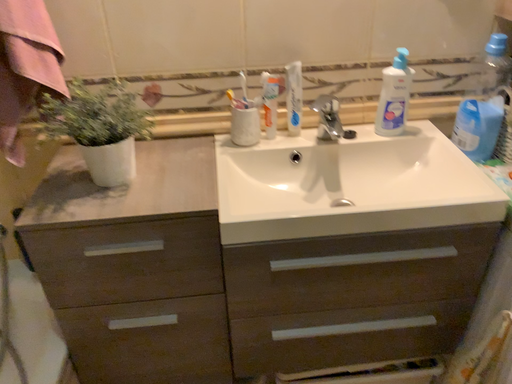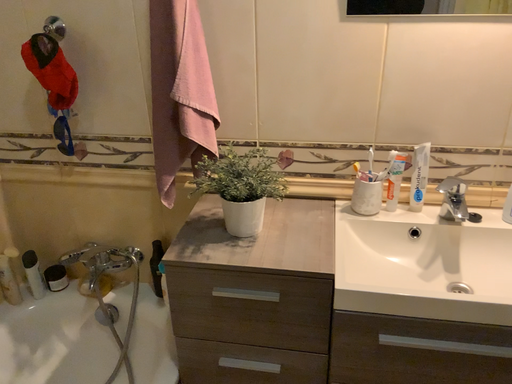
Question: How did the camera likely rotate when shooting the video?

Choices:
 (A) rotated left
 (B) rotated right

Answer: (A)